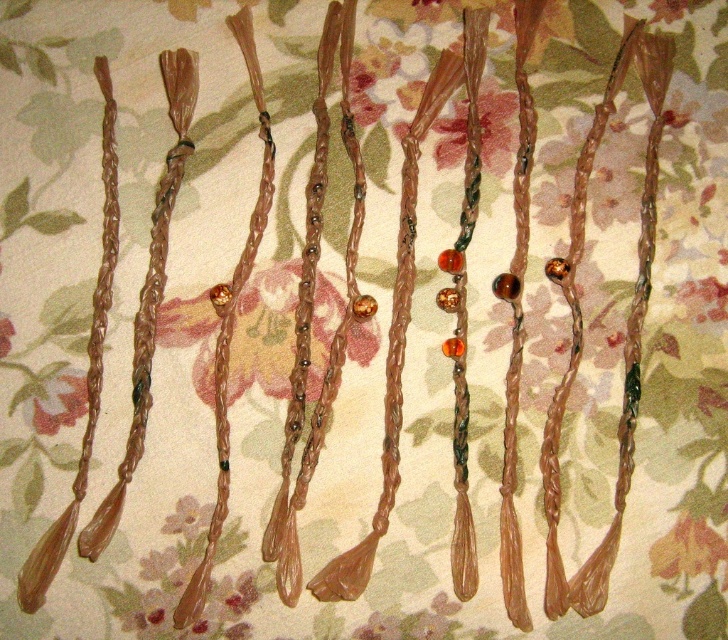
Question: Is translucent amber beads at center below matte floral fabric at lower left?

Choices:
 (A) yes
 (B) no

Answer: (B)

Question: Is translucent plastic flower at center closer to the viewer compared to matte floral fabric at lower left?

Choices:
 (A) yes
 (B) no

Answer: (B)

Question: Which of the following is the closest to the observer?

Choices:
 (A) (31, 403)
 (B) (483, 145)
 (C) (166, 326)

Answer: (A)

Question: Does translucent plastic flower at center have a lesser width compared to matte floral fabric at lower left?

Choices:
 (A) no
 (B) yes

Answer: (A)

Question: Which of the following is the farthest from the observer?

Choices:
 (A) matte floral fabric at lower left
 (B) translucent plastic flower at center

Answer: (B)

Question: Which object appears closest to the camera in this image?

Choices:
 (A) matte floral fabric at lower left
 (B) translucent plastic flower at center

Answer: (A)